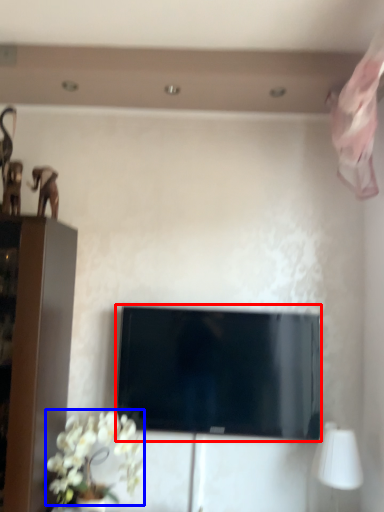
Question: Which object is closer to the camera taking this photo, television (highlighted by a red box) or flower (highlighted by a blue box)?

Choices:
 (A) television
 (B) flower

Answer: (B)